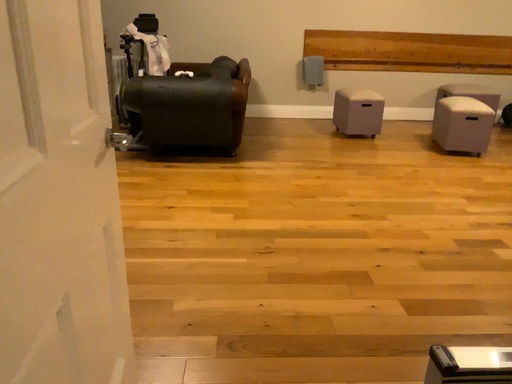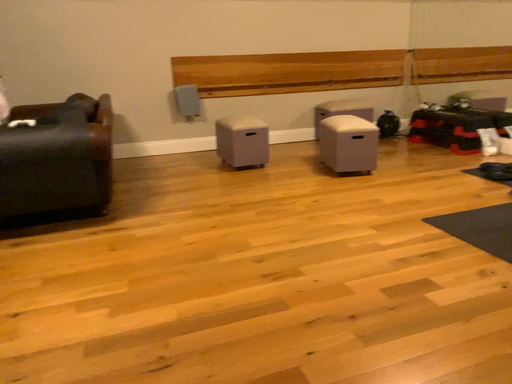
Question: Which way did the camera rotate in the video?

Choices:
 (A) rotated left
 (B) rotated right

Answer: (B)